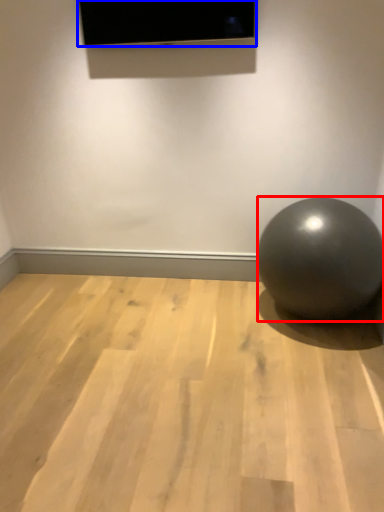
Question: Among these objects, which one is nearest to the camera, ball (highlighted by a red box) or projection screen (highlighted by a blue box)?

Choices:
 (A) ball
 (B) projection screen

Answer: (A)